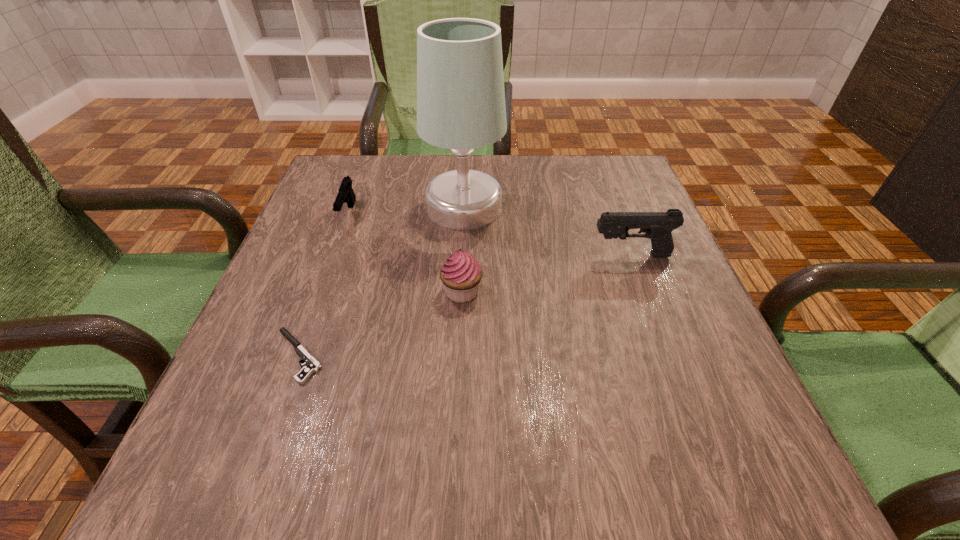
At what (x,y) coordinates should I click in order to perform the action: click on free space located 0.360m at the barrel of the rightmost object. Please return your answer as a coordinate pair (x, y). Looking at the image, I should click on (422, 255).

This screenshot has height=540, width=960. What are the coordinates of `blank space located at the barrel of the rightmost object` in the screenshot? It's located at (474, 255).

Find the location of `vacant space located on the left of the cupcake`. vacant space located on the left of the cupcake is located at coordinates (313, 292).

The height and width of the screenshot is (540, 960). Identify the location of vacant space located 0.340m on the front-facing side of the farthest pistol. tap(297, 355).

This screenshot has width=960, height=540. Find the location of `lampshade present at the far edge`. lampshade present at the far edge is located at coordinates (461, 106).

The image size is (960, 540). Identify the location of pistol that is at the far edge. (346, 194).

Where is `object present at the right edge`? The width and height of the screenshot is (960, 540). object present at the right edge is located at coordinates (657, 226).

Image resolution: width=960 pixels, height=540 pixels. What are the coordinates of `object at the far left corner` in the screenshot? It's located at (346, 194).

Identify the location of free space at the far edge of the desktop. The image size is (960, 540). click(x=408, y=160).

Where is `blank area at the near edge`? The image size is (960, 540). blank area at the near edge is located at coordinates (352, 444).